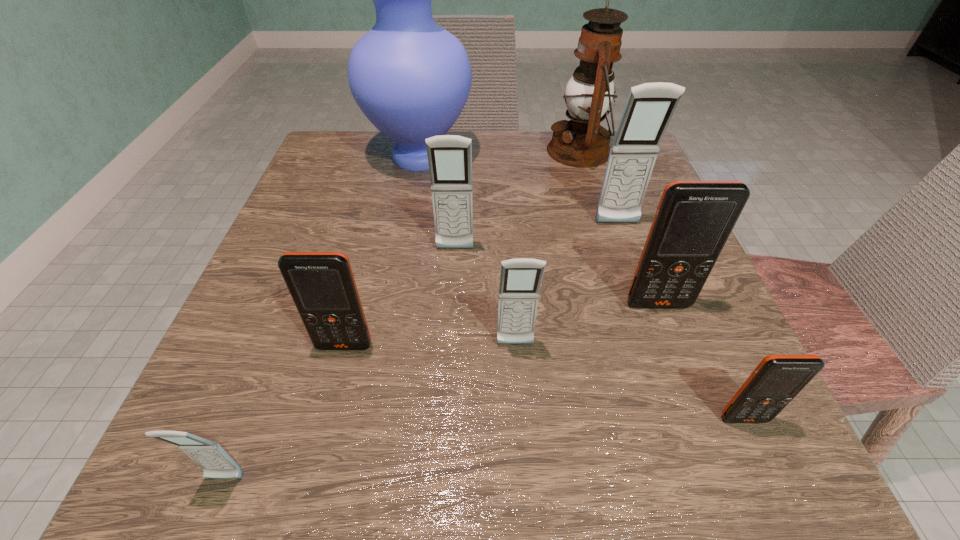
This screenshot has height=540, width=960. Find the location of `the sixth cellular telephone from right to left`. the sixth cellular telephone from right to left is located at coordinates (322, 285).

Find the location of `the second farthest orange cellular telephone`. the second farthest orange cellular telephone is located at coordinates click(322, 285).

You are a GUI agent. You are given a task and a screenshot of the screen. Output one action in this format:
    pyautogui.click(x=<x>, y=<y>)
    Task: Click on the sixth farthest cellular telephone
    
    Given the screenshot: What is the action you would take?
    pyautogui.click(x=777, y=379)

Locate an element on the screen. The width and height of the screenshot is (960, 540). the nearest orange cellular telephone is located at coordinates (777, 379).

The width and height of the screenshot is (960, 540). What are the coordinates of `the nearest gray cellular telephone` in the screenshot? It's located at (216, 463).

Where is `the nearest object`? The image size is (960, 540). the nearest object is located at coordinates (216, 463).

The height and width of the screenshot is (540, 960). I want to click on vacant region located on the side of the lantern, there is a wick adjustment knob, so click(x=525, y=151).

This screenshot has width=960, height=540. Find the location of `free space located 0.220m on the side of the lantern, there is a wick adjustment knob`. free space located 0.220m on the side of the lantern, there is a wick adjustment knob is located at coordinates (451, 151).

This screenshot has width=960, height=540. What are the coordinates of `free space located on the side of the lantern, there is a wick adjustment knob` in the screenshot? It's located at (412, 151).

Locate an element on the screen. This screenshot has height=540, width=960. free space located on the front of the blue vase is located at coordinates (396, 283).